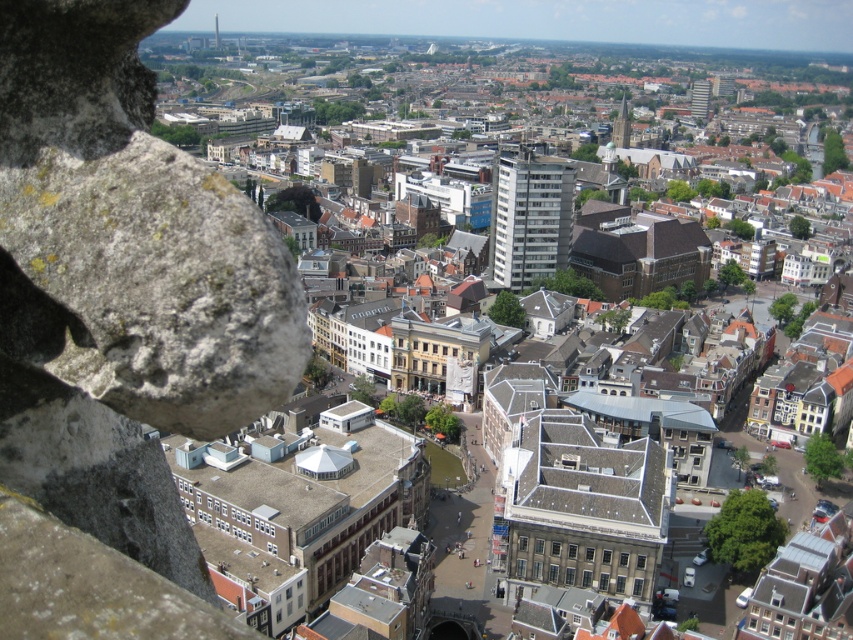
You are an architect analyzing the cityscape. You need to determine which structure has a greater height between the white smooth building at center and the smooth gray tower at upper center. Based on the scene provided, which one is taller?

The white smooth building at center is taller than the smooth gray tower at upper center according to the description.

You are an architect analyzing the city layout. You observe the white smooth building at center and the smooth gray tower at upper center. Which building is located to the right of the other?

The white smooth building at center is positioned on the right side of the smooth gray tower at upper center.

You are standing at the top of a tall building and looking out at the city. There are two points you can see in the distance. One is at coordinates point (521, 205) and the other is at point (218, 24). Which point is closer to you?

Point (521, 205) is closer to the camera than point (218, 24), so the point at coordinates point (521, 205) is closer to you.